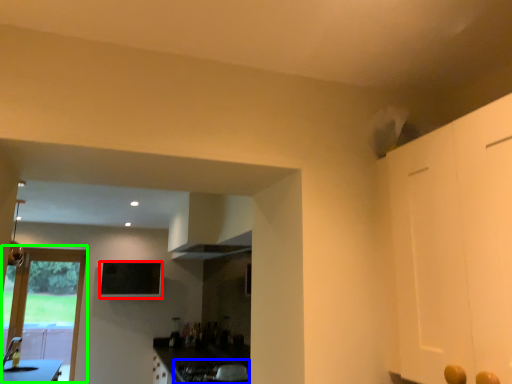
Question: Which object is the closest to the window screen (highlighted by a red box)? Choose among these: gas stove (highlighted by a blue box) or door (highlighted by a green box).

Choices:
 (A) gas stove
 (B) door

Answer: (B)